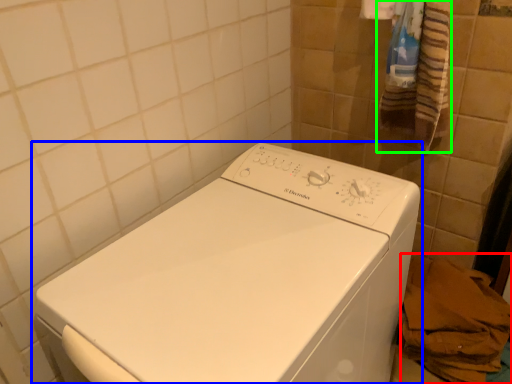
Question: Which object is positioned farthest from material (highlighted by a red box)? Select from washing machine (highlighted by a blue box) and bath towel (highlighted by a green box).

Choices:
 (A) washing machine
 (B) bath towel

Answer: (B)